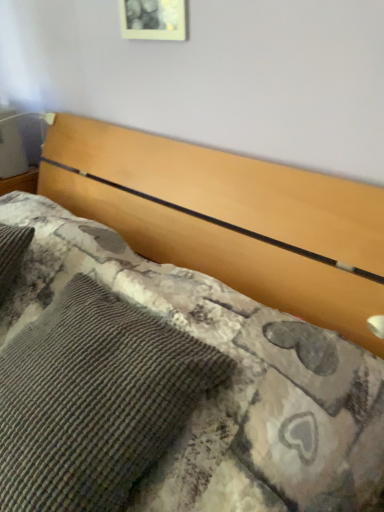
Measure the distance between woolen textured pillow at upper center and camera.

The depth of woolen textured pillow at upper center is 25.07 inches.

Locate an element on the screen. This screenshot has width=384, height=512. woolen textured pillow at upper center is located at coordinates (94, 400).

This screenshot has height=512, width=384. What do you see at coordinates (94, 400) in the screenshot?
I see `woolen textured pillow at upper center` at bounding box center [94, 400].

At what (x,y) coordinates should I click in order to perform the action: click on matte white picture frame at upper center. Please return your answer as a coordinate pair (x, y). The height and width of the screenshot is (512, 384). Looking at the image, I should click on (153, 19).

Measure the distance between matte white picture frame at upper center and camera.

matte white picture frame at upper center and camera are 3.60 feet apart from each other.

The width and height of the screenshot is (384, 512). What do you see at coordinates (153, 19) in the screenshot?
I see `matte white picture frame at upper center` at bounding box center [153, 19].

Find the location of a particular element. woolen textured pillow at upper center is located at coordinates point(94,400).

Can you confirm if matte white picture frame at upper center is positioned to the left of woolen textured pillow at upper center?

In fact, matte white picture frame at upper center is to the right of woolen textured pillow at upper center.

Which is behind, matte white picture frame at upper center or woolen textured pillow at upper center?

Positioned behind is matte white picture frame at upper center.

Considering the points (144, 31) and (7, 411), which point is behind, point (144, 31) or point (7, 411)?

The point (144, 31) is farther from the camera.

From the image's perspective, is matte white picture frame at upper center below woolen textured pillow at upper center?

No, from the image's perspective, matte white picture frame at upper center is not below woolen textured pillow at upper center.

From a real-world perspective, is matte white picture frame at upper center on woolen textured pillow at upper center?

Yes.

Does matte white picture frame at upper center have a lesser width compared to woolen textured pillow at upper center?

Yes.

Does matte white picture frame at upper center have a lesser height compared to woolen textured pillow at upper center?

Correct, matte white picture frame at upper center is not as tall as woolen textured pillow at upper center.

In terms of size, does matte white picture frame at upper center appear bigger or smaller than woolen textured pillow at upper center?

Considering their sizes, matte white picture frame at upper center takes up less space than woolen textured pillow at upper center.

Is woolen textured pillow at upper center completely or partially inside matte white picture frame at upper center?

Result: Definitely not — woolen textured pillow at upper center is not inside matte white picture frame at upper center.

Is the surface of matte white picture frame at upper center in direct contact with woolen textured pillow at upper center?

No, matte white picture frame at upper center is not touching woolen textured pillow at upper center.

Is matte white picture frame at upper center oriented towards woolen textured pillow at upper center?

No, matte white picture frame at upper center is not turned towards woolen textured pillow at upper center.

Can you tell me how much matte white picture frame at upper center and woolen textured pillow at upper center differ in facing direction?

There is a 0.00237-degree angle between the facing directions of matte white picture frame at upper center and woolen textured pillow at upper center.

Find the location of `picture frame above the woolen textured pillow at upper center (from a real-world perspective)`. picture frame above the woolen textured pillow at upper center (from a real-world perspective) is located at coordinates tap(153, 19).

Which is more to the right, woolen textured pillow at upper center or matte white picture frame at upper center?

From the viewer's perspective, matte white picture frame at upper center appears more on the right side.

Considering their positions, is woolen textured pillow at upper center located in front of or behind matte white picture frame at upper center?

Clearly, woolen textured pillow at upper center is in front of matte white picture frame at upper center.

Based on the photo, which point is more distant from viewer, (91, 451) or (144, 0)?

Positioned behind is point (144, 0).

From the image's perspective, which one is positioned lower, woolen textured pillow at upper center or matte white picture frame at upper center?

woolen textured pillow at upper center, from the image's perspective.

From a real-world perspective, between woolen textured pillow at upper center and matte white picture frame at upper center, who is vertically lower?

In real-world perspective, woolen textured pillow at upper center is lower.

Looking at their sizes, would you say woolen textured pillow at upper center is wider or thinner than matte white picture frame at upper center?

woolen textured pillow at upper center is wider than matte white picture frame at upper center.

Which of these two, woolen textured pillow at upper center or matte white picture frame at upper center, stands shorter?

Standing shorter between the two is matte white picture frame at upper center.

Considering the sizes of objects woolen textured pillow at upper center and matte white picture frame at upper center in the image provided, who is smaller, woolen textured pillow at upper center or matte white picture frame at upper center?

Smaller between the two is matte white picture frame at upper center.

Based on the photo, would you say woolen textured pillow at upper center is inside or outside matte white picture frame at upper center?

woolen textured pillow at upper center lies outside matte white picture frame at upper center.

Is the surface of woolen textured pillow at upper center in direct contact with matte white picture frame at upper center?

They are not placed beside each other.

Is matte white picture frame at upper center at the back of woolen textured pillow at upper center?

No, matte white picture frame at upper center is not at the back of woolen textured pillow at upper center.

How distant is woolen textured pillow at upper center from matte white picture frame at upper center?

A distance of 36.12 inches exists between woolen textured pillow at upper center and matte white picture frame at upper center.

Find the location of a particular element. Image resolution: width=384 pixels, height=512 pixels. picture frame on the right of the woolen textured pillow at upper center is located at coordinates (153, 19).

This screenshot has height=512, width=384. I want to click on picture frame that is above the woolen textured pillow at upper center (from the image's perspective), so click(153, 19).

Find the location of `picture frame behind the woolen textured pillow at upper center`. picture frame behind the woolen textured pillow at upper center is located at coordinates (153, 19).